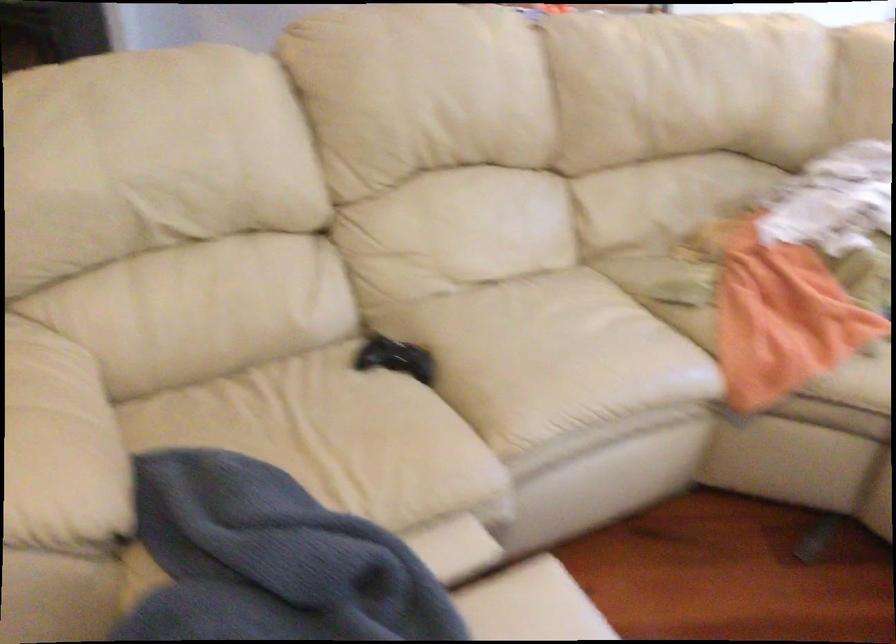
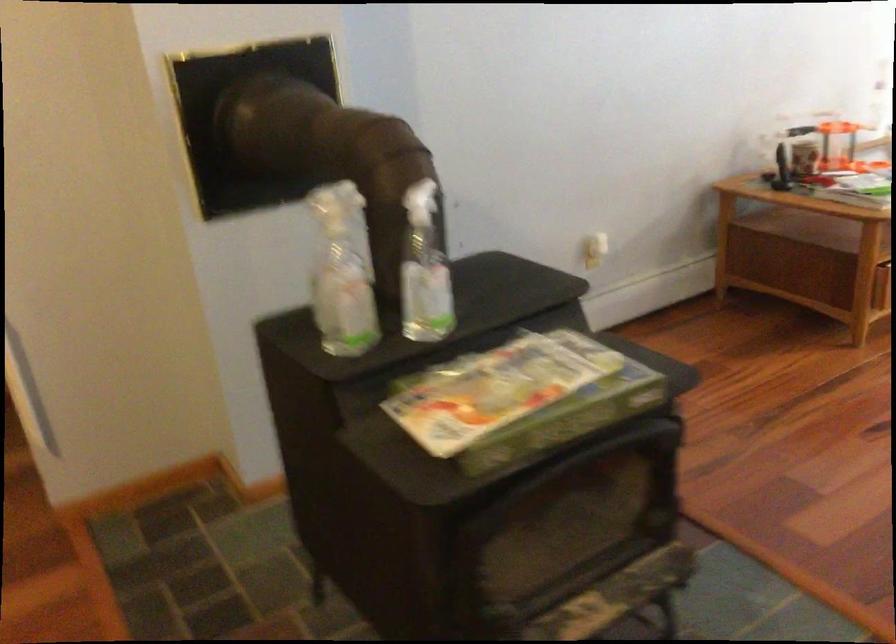
The images are taken continuously from a first-person perspective. In which direction are you moving?

The cameraman walked toward left, forward.